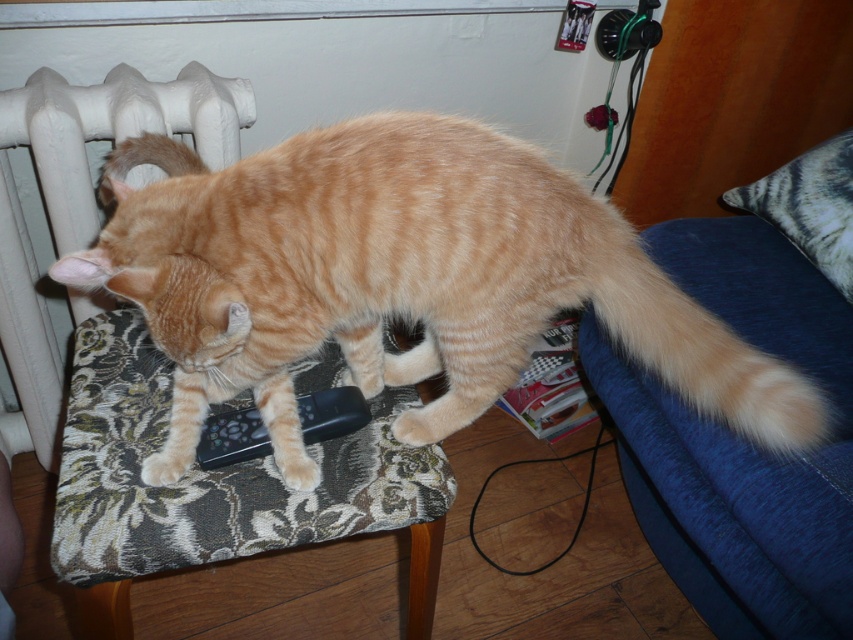
You are a photographer trying to capture a closeup shot of the orange striped fur cat at center. Given that the cat is larger than the floral fabric armchair at center, will you need to move closer or farther away from the chair to focus on the cat?

The orange striped fur cat at center is larger than the floral fabric armchair at center, so you will need to move farther away from the chair to focus on the cat.

You are a cat owner who wants to ensure the orange striped fur cat at center can comfortably sit on the floral fabric armchair at center. Based on their sizes, is the cat likely to fit comfortably on the chair?

The orange striped fur cat at center has a lesser height compared to the floral fabric armchair at center, so the cat should fit comfortably on the chair.

You are a cat owner who wants to place a small toy at point (x=457, y=157) in the scene. The toy requires a minimum of 30 inches of space from the viewer to ensure safety. Can you safely place the toy there?

The distance of point (x=457, y=157) from the viewer is 33.50 inches, which exceeds the minimum required 30 inches. Therefore, the toy can be safely placed there.